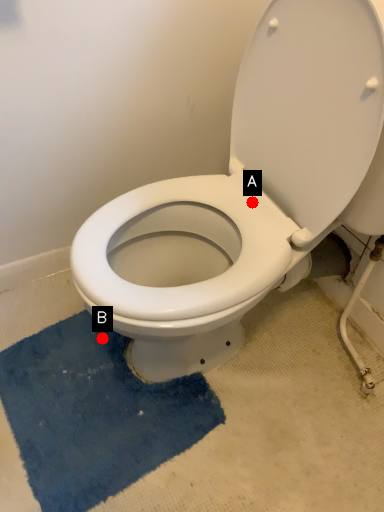
Question: Two points are circled on the image, labeled by A and B beside each circle. Which point appears closest to the camera in this image?

Choices:
 (A) A is closer
 (B) B is closer

Answer: (A)